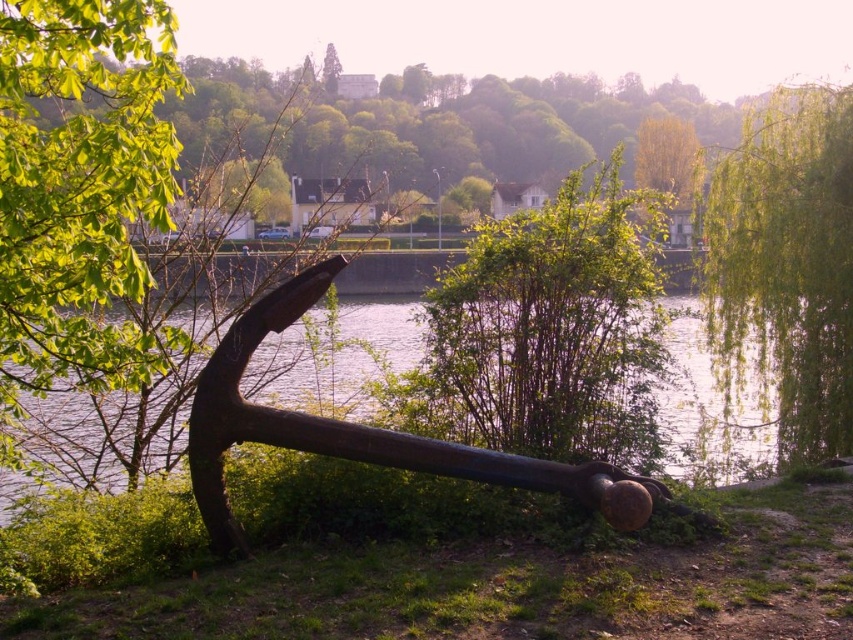
Question: Where is green leafy tree at right located in relation to rusty metal anchor at center in the image?

Choices:
 (A) left
 (B) right

Answer: (B)

Question: Which of the following is the farthest from the observer?

Choices:
 (A) [843, 173]
 (B) [93, 148]

Answer: (A)

Question: Which of the following is the closest to the observer?

Choices:
 (A) (680, 220)
 (B) (440, 326)
 (C) (386, 440)
 (D) (787, 100)

Answer: (C)

Question: Which point is closer to the camera taking this photo?

Choices:
 (A) (670, 241)
 (B) (163, 200)
 (C) (845, 282)
 (D) (241, 330)

Answer: (B)

Question: Is green leafy tree at center to the right of rusty metal anchor at center from the viewer's perspective?

Choices:
 (A) no
 (B) yes

Answer: (A)

Question: Is green grass at lower center below green leafy tree at center?

Choices:
 (A) no
 (B) yes

Answer: (B)